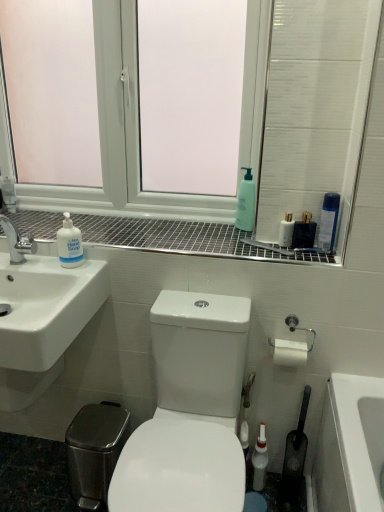
I want to click on free spot to the left of black plastic mouthwash at upper right, the third mouthwash viewed from the left, so click(x=249, y=244).